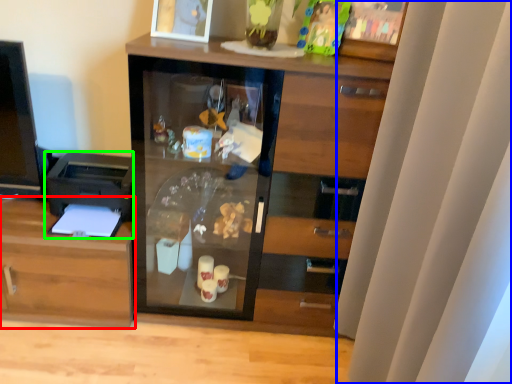
Question: Estimate the real-world distances between objects in this image. Which object is closer to cabinetry (highlighted by a red box), curtain (highlighted by a blue box) or printer (highlighted by a green box)?

Choices:
 (A) curtain
 (B) printer

Answer: (B)